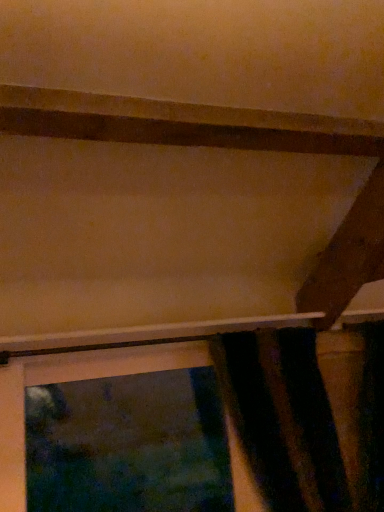
Image resolution: width=384 pixels, height=512 pixels. I want to click on black fuzzy curtain at lower right, so click(x=307, y=413).

The image size is (384, 512). Describe the element at coordinates (307, 413) in the screenshot. I see `black fuzzy curtain at lower right` at that location.

Identify the location of black fuzzy curtain at lower right. This screenshot has width=384, height=512. (307, 413).